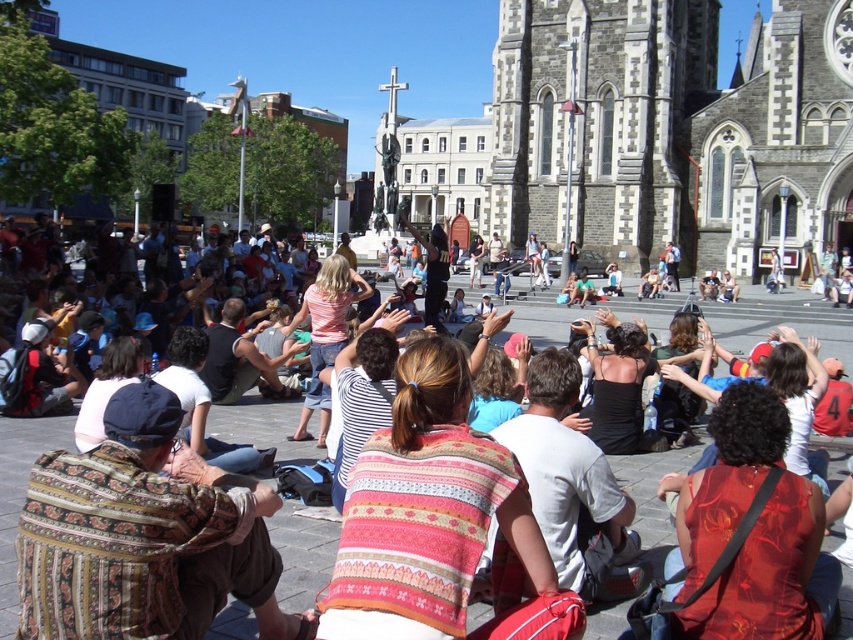
Does striped fabric shirt at center appear over black satin dress at center?

No, striped fabric shirt at center is not above black satin dress at center.

Does striped fabric shirt at center appear on the left side of black satin dress at center?

Correct, you'll find striped fabric shirt at center to the left of black satin dress at center.

Is point (438, 416) farther from camera compared to point (596, 413)?

That is False.

I want to click on striped fabric shirt at center, so [438, 522].

Can you confirm if floral silk dress at center is bigger than black satin dress at center?

Correct, floral silk dress at center is larger in size than black satin dress at center.

Is point (722, 412) positioned behind point (633, 410)?

No, it is in front of (633, 410).

The width and height of the screenshot is (853, 640). Identify the location of floral silk dress at center. (752, 532).

The image size is (853, 640). Find the location of `floral silk dress at center`. floral silk dress at center is located at coordinates click(x=752, y=532).

Is point (279, 499) behind point (409, 545)?

Yes, it is behind point (409, 545).

Between patterned fabric shirt at lower left and striped fabric shirt at center, which one appears on the left side from the viewer's perspective?

patterned fabric shirt at lower left is more to the left.

The image size is (853, 640). What do you see at coordinates (143, 538) in the screenshot?
I see `patterned fabric shirt at lower left` at bounding box center [143, 538].

Find the location of a particular element. Image resolution: width=853 pixels, height=640 pixels. patterned fabric shirt at lower left is located at coordinates (143, 538).